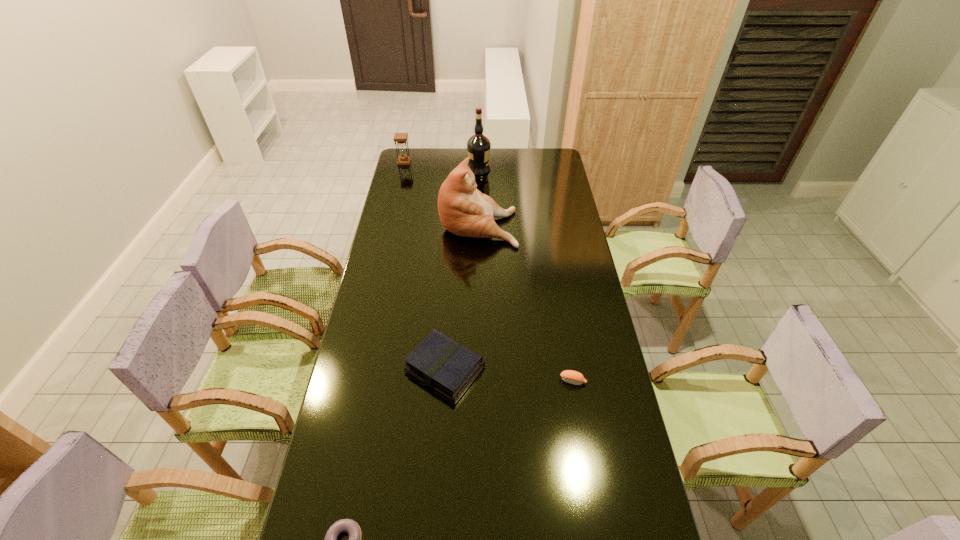
Locate an element on the screen. The height and width of the screenshot is (540, 960). vacant space at the far right corner of the desktop is located at coordinates (547, 150).

Find the location of a particular element. The width and height of the screenshot is (960, 540). free space between the fourth tallest object and the third tallest object is located at coordinates (424, 265).

At what (x,y) coordinates should I click in order to perform the action: click on free area in between the fifth tallest object and the hourglass. Please return your answer as a coordinate pair (x, y). The width and height of the screenshot is (960, 540). Looking at the image, I should click on (489, 271).

The width and height of the screenshot is (960, 540). I want to click on free area in between the hourglass and the liquor, so click(x=442, y=166).

Identify the location of vacant region between the liquor and the second shortest object. Image resolution: width=960 pixels, height=540 pixels. (526, 275).

Locate an element on the screen. The height and width of the screenshot is (540, 960). vacant area between the fourth tallest object and the hourglass is located at coordinates (424, 265).

Locate an element on the screen. free space between the liquor and the third tallest object is located at coordinates (442, 166).

The width and height of the screenshot is (960, 540). Identify the location of vacant area that lies between the fourth tallest object and the rightmost object. (509, 374).

This screenshot has height=540, width=960. I want to click on free space between the fifth tallest object and the third shortest object, so click(x=509, y=374).

Point out which object is positioned as the fourth nearest to the third shortest object. Please provide its 2D coordinates. Your answer should be formatted as a tuple, i.e. [(x, y)], where the tuple contains the x and y coordinates of a point satisfying the conditions above.

[(478, 146)]